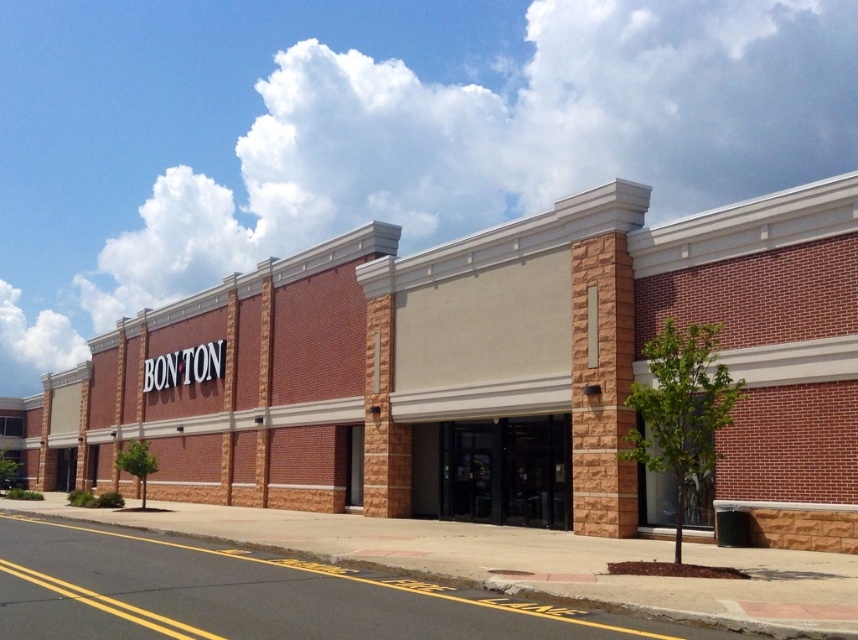
Based on the photo, does brick building at center appear on the right side of black glass doors at center?

Incorrect, brick building at center is not on the right side of black glass doors at center.

Does brick building at center lie behind black glass doors at center?

No, it is in front of black glass doors at center.

Where is `brick building at center`? This screenshot has width=858, height=640. brick building at center is located at coordinates click(488, 372).